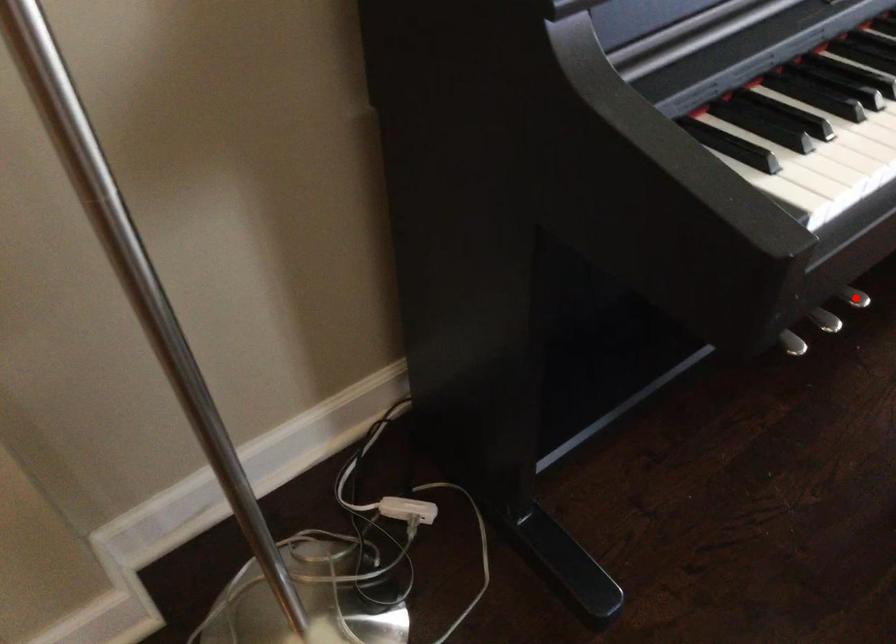
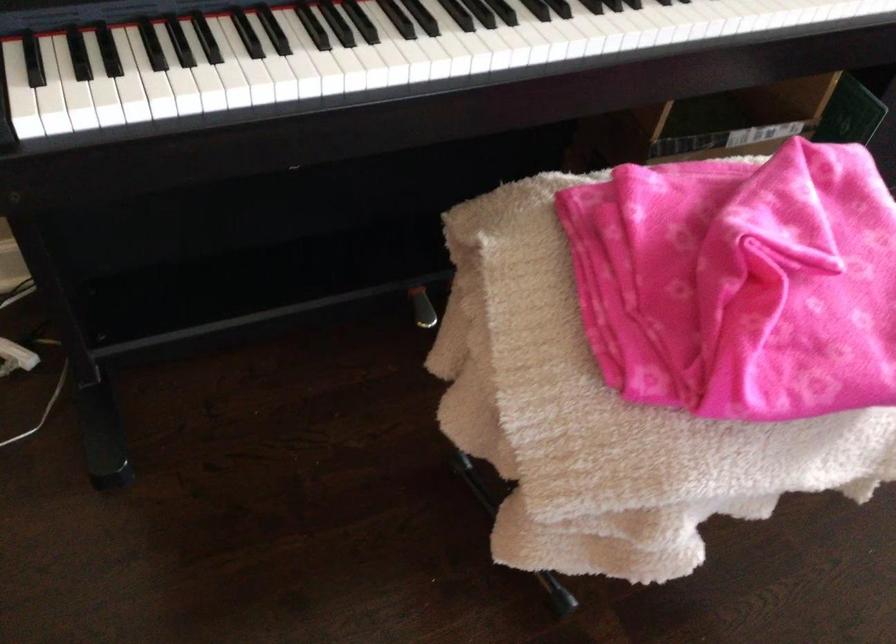
Question: I am providing you with two images of the same scene from different viewpoints. A red point is marked on the first image. Can you still see the location of the red point in image 2?

Choices:
 (A) Yes
 (B) No

Answer: (B)